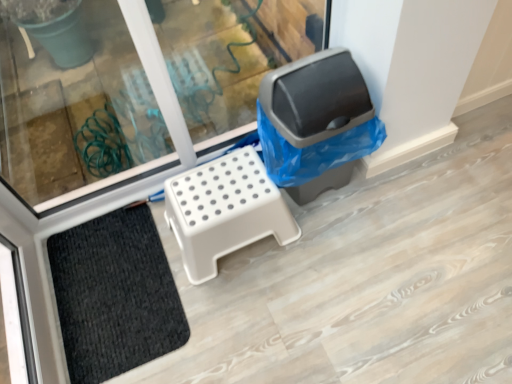
The image size is (512, 384). Find the location of `vacant area that lies to the right of gray plastic recycling bin at right`. vacant area that lies to the right of gray plastic recycling bin at right is located at coordinates [402, 191].